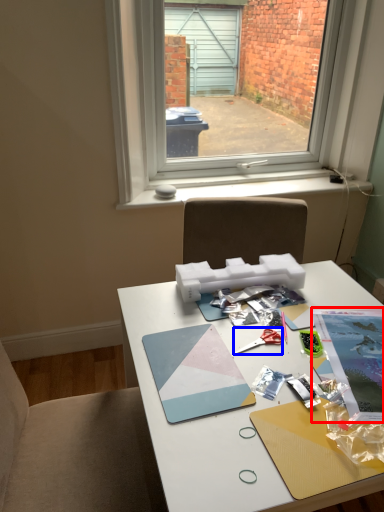
Question: Which object appears farthest to the camera in this image, magazine (highlighted by a red box) or scissors (highlighted by a blue box)?

Choices:
 (A) magazine
 (B) scissors

Answer: (B)